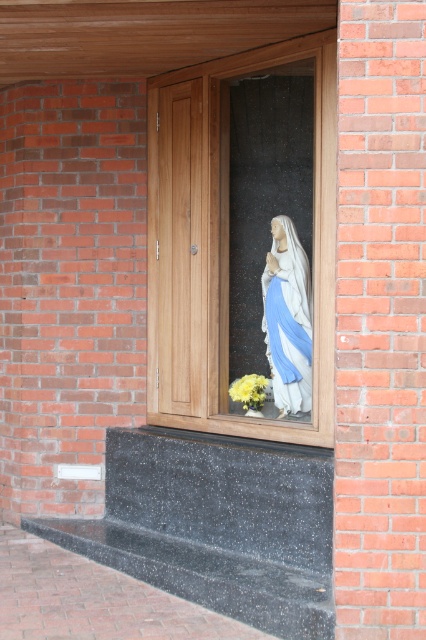
Question: Among these objects, which one is farthest from the camera?

Choices:
 (A) transparent glass statue at center
 (B) white marble statue at center

Answer: (B)

Question: From the image, what is the correct spatial relationship of white marble statue at center in relation to yellow matte flower at center?

Choices:
 (A) below
 (B) above

Answer: (B)

Question: In this image, where is white marble statue at center located relative to yellow matte flower at center?

Choices:
 (A) below
 (B) above

Answer: (B)

Question: Does transparent glass statue at center have a lesser width compared to yellow matte flower at center?

Choices:
 (A) yes
 (B) no

Answer: (B)

Question: Among these points, which one is farthest from the camera?

Choices:
 (A) pyautogui.click(x=282, y=122)
 (B) pyautogui.click(x=255, y=380)
 (C) pyautogui.click(x=298, y=365)

Answer: (A)

Question: Based on their relative distances, which object is farther from the white marble statue at center?

Choices:
 (A) yellow matte flower at center
 (B) transparent glass statue at center

Answer: (A)